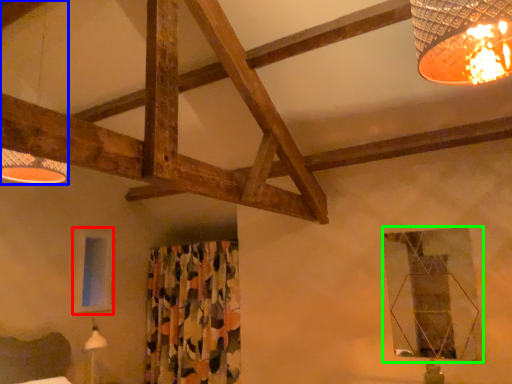
Question: Which is nearer to the window (highlighted by a red box)? lamp (highlighted by a blue box) or window (highlighted by a green box).

Choices:
 (A) lamp
 (B) window

Answer: (A)